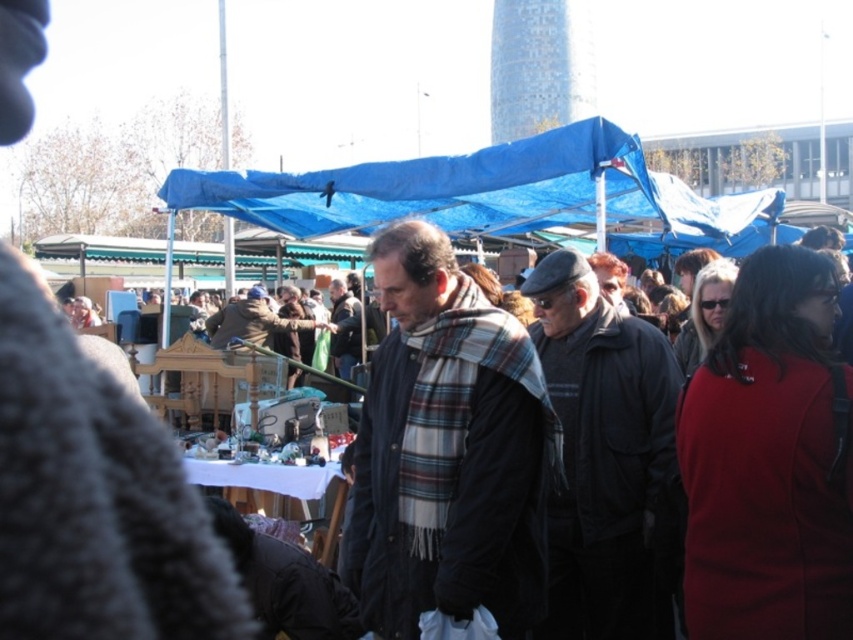
Who is shorter, plaid scarf at center or blue tarpaulin canopy at upper center?

blue tarpaulin canopy at upper center

Is plaid scarf at center taller than blue tarpaulin canopy at upper center?

Indeed, plaid scarf at center has a greater height compared to blue tarpaulin canopy at upper center.

The height and width of the screenshot is (640, 853). Describe the element at coordinates (448, 451) in the screenshot. I see `plaid scarf at center` at that location.

Where is `plaid scarf at center`? The image size is (853, 640). plaid scarf at center is located at coordinates (448, 451).

Is plaid scarf at center to the left of dark gray woolen jacket at center from the viewer's perspective?

Correct, you'll find plaid scarf at center to the left of dark gray woolen jacket at center.

Does plaid scarf at center have a greater height compared to dark gray woolen jacket at center?

In fact, plaid scarf at center may be shorter than dark gray woolen jacket at center.

Describe the element at coordinates (448, 451) in the screenshot. The image size is (853, 640). I see `plaid scarf at center` at that location.

Where is `plaid scarf at center`? plaid scarf at center is located at coordinates (448, 451).

Which of these two, dark gray woolen jacket at center or blue tarpaulin canopy at upper center, stands shorter?

blue tarpaulin canopy at upper center

Between point (566, 307) and point (302, 211), which one is positioned in front?

Positioned in front is point (566, 307).

Does point (637, 468) come behind point (630, 198)?

That is False.

I want to click on dark gray woolen jacket at center, so click(602, 454).